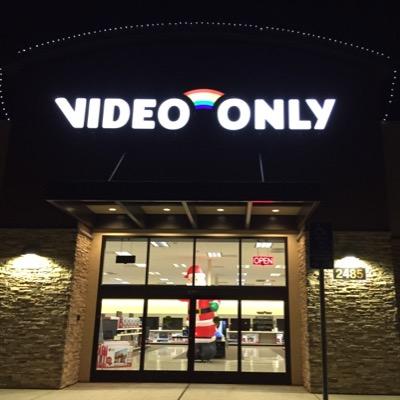
Locate an element on the screen. doors is located at coordinates (160, 302).